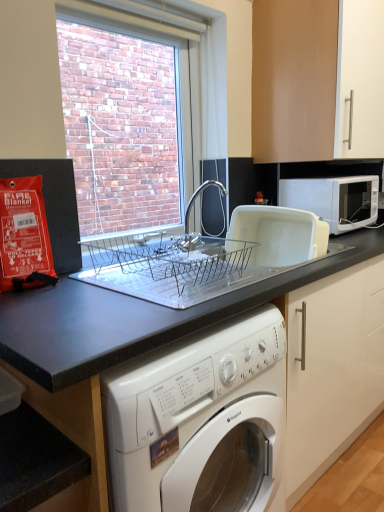
This screenshot has width=384, height=512. Describe the element at coordinates (120, 339) in the screenshot. I see `black granite countertop at center` at that location.

What is the approximate width of clear glass window screen at upper center?

clear glass window screen at upper center is 2.76 inches in width.

Image resolution: width=384 pixels, height=512 pixels. What do you see at coordinates (123, 123) in the screenshot? I see `clear glass window screen at upper center` at bounding box center [123, 123].

Where is `white matte microwave at upper right`? white matte microwave at upper right is located at coordinates [334, 200].

You are a GUI agent. You are given a task and a screenshot of the screen. Output one action in this format:
    pyautogui.click(x=<x>, y=<y>)
    Task: Click on the matte wood cabinet at upper right
    The image size is (384, 512).
    Given the screenshot: What is the action you would take?
    pyautogui.click(x=316, y=79)

This screenshot has width=384, height=512. What are the coordinates of `black granite countertop at center` in the screenshot? It's located at [120, 339].

Would you say black granite countertop at center is to the left or to the right of white matte microwave at upper right in the picture?

black granite countertop at center is to the left of white matte microwave at upper right.

From the image's perspective, is black granite countertop at center below white matte microwave at upper right?

Correct, black granite countertop at center appears lower than white matte microwave at upper right in the image.

Considering the positions of objects black granite countertop at center and white matte microwave at upper right in the image provided, who is behind, black granite countertop at center or white matte microwave at upper right?

white matte microwave at upper right is further away from the camera.

Considering the points (366, 237) and (287, 179), which point is in front, point (366, 237) or point (287, 179)?

The point (366, 237) is closer.

Can clear glass window screen at upper center be found inside white plastic dish drainer at upper right?

No, white plastic dish drainer at upper right does not contain clear glass window screen at upper center.

From the image's perspective, is white plastic dish drainer at upper right located beneath clear glass window screen at upper center?

Indeed, from the image's perspective, white plastic dish drainer at upper right is shown beneath clear glass window screen at upper center.

From a real-world perspective, is white plastic dish drainer at upper right above or below clear glass window screen at upper center?

In terms of real-world spatial position, white plastic dish drainer at upper right is below clear glass window screen at upper center.

Identify the location of cabinetry located behind the white plastic dish drainer at upper right. This screenshot has width=384, height=512. (316, 79).

Based on the photo, from a real-world perspective, is matte wood cabinet at upper right on top of white plastic dish drainer at upper right?

Yes.

Which is behind, matte wood cabinet at upper right or white plastic dish drainer at upper right?

→ matte wood cabinet at upper right is behind.

Considering the sizes of objects white matte microwave at upper right and clear glass window screen at upper center in the image provided, who is smaller, white matte microwave at upper right or clear glass window screen at upper center?

With smaller size is white matte microwave at upper right.

Which object is thinner, white matte microwave at upper right or clear glass window screen at upper center?

Thinner between the two is clear glass window screen at upper center.

Considering the relative positions of white matte microwave at upper right and clear glass window screen at upper center in the image provided, is white matte microwave at upper right to the left of clear glass window screen at upper center from the viewer's perspective?

In fact, white matte microwave at upper right is to the right of clear glass window screen at upper center.

Can we say white matte microwave at upper right lies outside clear glass window screen at upper center?

Yes, white matte microwave at upper right is outside of clear glass window screen at upper center.

Is white plastic dish drainer at upper right aimed at white matte microwave at upper right?

No, white plastic dish drainer at upper right is not turned towards white matte microwave at upper right.

Which is more to the left, white plastic dish drainer at upper right or white matte microwave at upper right?

Positioned to the left is white plastic dish drainer at upper right.

From the image's perspective, between white plastic dish drainer at upper right and white matte microwave at upper right, who is located below?

white plastic dish drainer at upper right.

Is black granite countertop at center not near matte wood cabinet at upper right?

No, black granite countertop at center is not far from matte wood cabinet at upper right.

From a real-world perspective, is black granite countertop at center under matte wood cabinet at upper right?

Indeed, from a real-world perspective, black granite countertop at center is positioned beneath matte wood cabinet at upper right.

Is point (3, 306) farther from camera compared to point (323, 148)?

No, (3, 306) is in front of (323, 148).

What are the coordinates of `cabinetry behind the black granite countertop at center` in the screenshot? It's located at (316, 79).

From a real-world perspective, relative to matte wood cabinet at upper right, is clear glass window screen at upper center vertically above or below?

clear glass window screen at upper center is below matte wood cabinet at upper right.

I want to click on window screen on the left of the matte wood cabinet at upper right, so click(x=123, y=123).

From the image's perspective, is clear glass window screen at upper center positioned above or below matte wood cabinet at upper right?

Based on their image positions, clear glass window screen at upper center is located beneath matte wood cabinet at upper right.

Does clear glass window screen at upper center turn towards matte wood cabinet at upper right?

No, clear glass window screen at upper center is not facing towards matte wood cabinet at upper right.

At what (x,y) coordinates should I click in order to perform the action: click on countertop in front of the white matte microwave at upper right. Please return your answer as a coordinate pair (x, y). This screenshot has height=512, width=384. Looking at the image, I should click on (120, 339).

You are a GUI agent. You are given a task and a screenshot of the screen. Output one action in this format:
    pyautogui.click(x=<x>, y=<y>)
    Task: Click on the window screen above the white plastic dish drainer at upper right (from the image's perspective)
    The image size is (384, 512).
    Given the screenshot: What is the action you would take?
    pos(123,123)

Based on their spatial positions, is clear glass window screen at upper center or matte wood cabinet at upper right closer to white matte microwave at upper right?

matte wood cabinet at upper right is closer to white matte microwave at upper right.

Which object lies further to the anchor point matte wood cabinet at upper right, white matte microwave at upper right or black granite countertop at center?

Among the two, black granite countertop at center is located further to matte wood cabinet at upper right.

Considering their positions, is white matte microwave at upper right positioned closer to clear glass window screen at upper center than matte wood cabinet at upper right?

Among the two, matte wood cabinet at upper right is located nearer to clear glass window screen at upper center.

When comparing their distances from white plastic dish drainer at upper right, does matte wood cabinet at upper right or clear glass window screen at upper center seem further?

Based on the image, clear glass window screen at upper center appears to be further to white plastic dish drainer at upper right.

Which object lies further to the anchor point black granite countertop at center, matte wood cabinet at upper right or white matte microwave at upper right?

matte wood cabinet at upper right is positioned further to the anchor black granite countertop at center.

Looking at the image, which one is located closer to black granite countertop at center, white plastic dish drainer at upper right or white matte microwave at upper right?

white plastic dish drainer at upper right lies closer to black granite countertop at center than the other object.

Based on the photo, considering their positions, is matte wood cabinet at upper right positioned further to clear glass window screen at upper center than black granite countertop at center?

Based on the image, black granite countertop at center appears to be further to clear glass window screen at upper center.

Considering their positions, is black granite countertop at center positioned further to white plastic dish drainer at upper right than clear glass window screen at upper center?

clear glass window screen at upper center lies further to white plastic dish drainer at upper right than the other object.

This screenshot has width=384, height=512. Find the location of `window screen positioned between black granite countertop at center and white matte microwave at upper right from near to far`. window screen positioned between black granite countertop at center and white matte microwave at upper right from near to far is located at coordinates (123, 123).

This screenshot has height=512, width=384. What are the coordinates of `window screen between matte wood cabinet at upper right and black granite countertop at center from top to bottom` in the screenshot? It's located at (123, 123).

Where is `cabinetry between clear glass window screen at upper center and white matte microwave at upper right from left to right`? The width and height of the screenshot is (384, 512). cabinetry between clear glass window screen at upper center and white matte microwave at upper right from left to right is located at coordinates (316, 79).

Locate an element on the screen. This screenshot has width=384, height=512. appliance between matte wood cabinet at upper right and black granite countertop at center vertically is located at coordinates (279, 234).